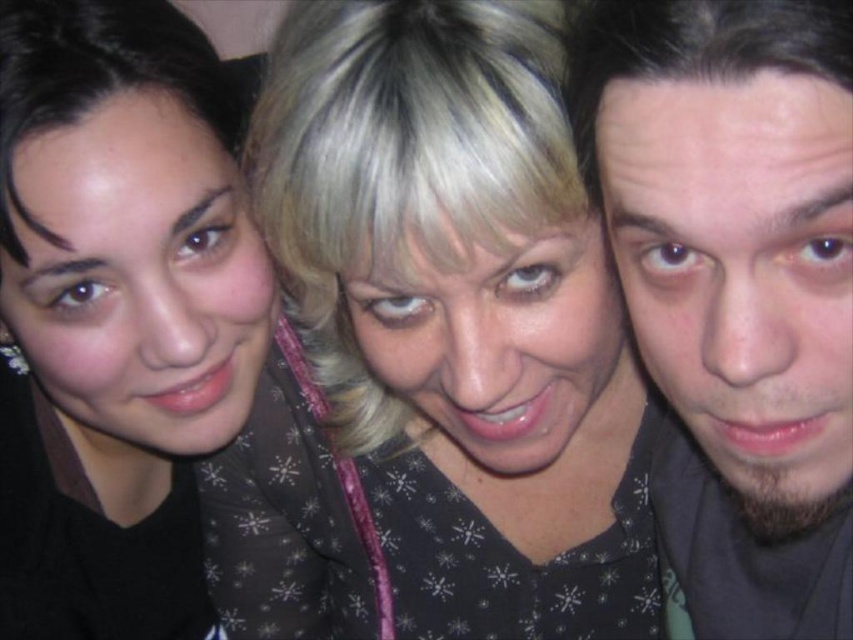
Question: Can you confirm if beige matte skin at right is positioned to the left of matte black face at left?

Choices:
 (A) yes
 (B) no

Answer: (B)

Question: Among these points, which one is nearest to the camera?

Choices:
 (A) (669, 170)
 (B) (606, 524)

Answer: (A)

Question: Considering the relative positions of matte black face at left and matte black face at center in the image provided, where is matte black face at left located with respect to matte black face at center?

Choices:
 (A) left
 (B) right

Answer: (A)

Question: Which point is farther to the camera?

Choices:
 (A) (666, 182)
 (B) (409, 339)
 (C) (399, 371)

Answer: (C)

Question: Which is nearer to the matte black face at left?

Choices:
 (A) matte black face at center
 (B) black matte shirt at center

Answer: (B)

Question: Can you confirm if beige matte skin at right is wider than matte black face at center?

Choices:
 (A) no
 (B) yes

Answer: (A)